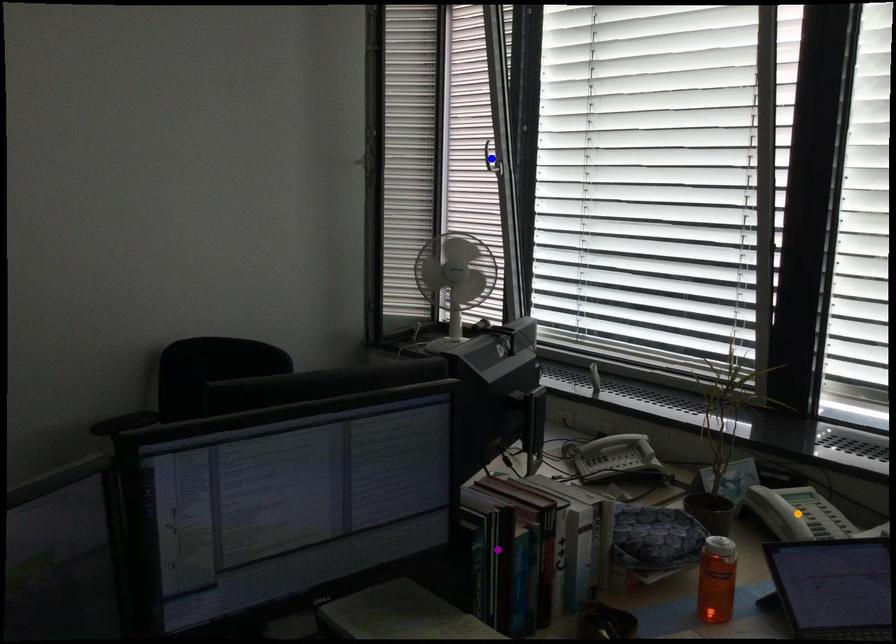
Order these from nearest to farthest:
orange point, purple point, blue point

purple point
orange point
blue point